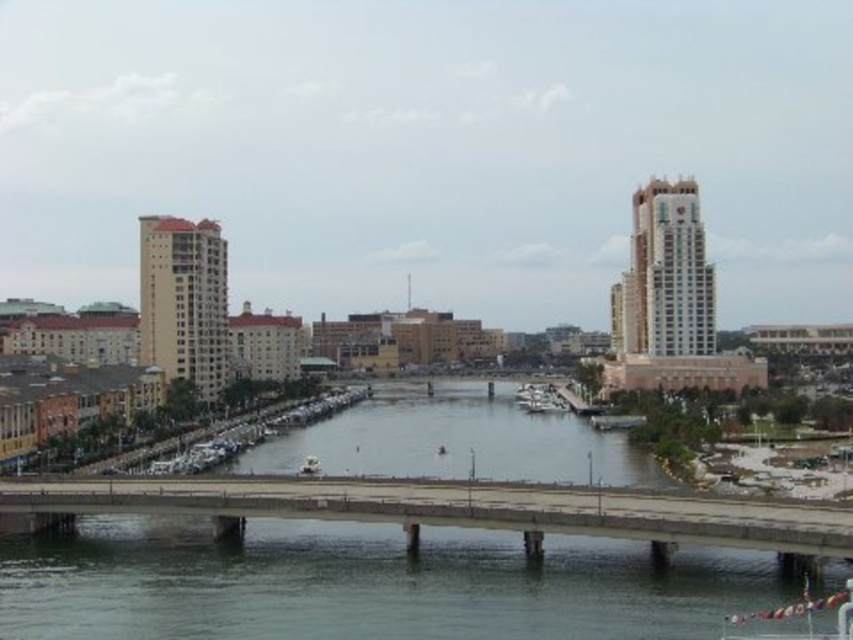
Question: Which object is closer to the camera taking this photo?

Choices:
 (A) concrete bridge at center
 (B) white glossy boat at center

Answer: (A)

Question: Which of the following is the farthest from the observer?

Choices:
 (A) (534, 406)
 (B) (712, 524)

Answer: (A)

Question: Considering the relative positions of concrete bridge at center and white glossy boat at center in the image provided, where is concrete bridge at center located with respect to white glossy boat at center?

Choices:
 (A) above
 (B) below

Answer: (A)

Question: Which point is closer to the camera?

Choices:
 (A) (447, 488)
 (B) (524, 404)

Answer: (A)

Question: Does concrete bridge at center have a lesser width compared to white glossy boat at center?

Choices:
 (A) no
 (B) yes

Answer: (A)

Question: Can you confirm if concrete bridge at center is positioned to the left of white glossy boat at center?

Choices:
 (A) no
 (B) yes

Answer: (B)